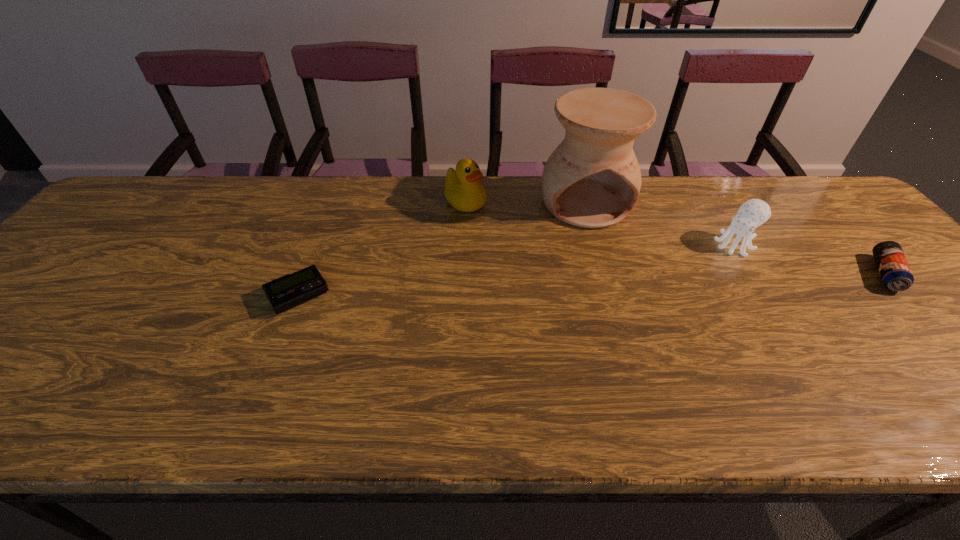
Locate an element on the screen. Image resolution: width=960 pixels, height=540 pixels. free space between the second shortest object and the octopus is located at coordinates (810, 259).

Locate an element on the screen. The width and height of the screenshot is (960, 540). free space between the fourth object from right to left and the rightmost object is located at coordinates (676, 239).

Identify the location of free area in between the second shortest object and the fourth shortest object. (676, 239).

This screenshot has width=960, height=540. What are the coordinates of `empty location between the beeper and the fourth tallest object` in the screenshot? It's located at (592, 285).

Identify the location of vacant space that's between the fourth object from left to right and the beer can. (810, 259).

Where is `vacant area that lies between the third object from right to left and the leftmost object`? Image resolution: width=960 pixels, height=540 pixels. vacant area that lies between the third object from right to left and the leftmost object is located at coordinates (443, 249).

Identify the location of free space between the second shortest object and the shortest object. This screenshot has width=960, height=540. (592, 285).

The height and width of the screenshot is (540, 960). What are the coordinates of `vacant space in between the octopus and the beeper` in the screenshot? It's located at (516, 270).

The width and height of the screenshot is (960, 540). In order to click on free space between the leftmost object and the beer can in this screenshot , I will do `click(592, 285)`.

At what (x,y) coordinates should I click in order to perform the action: click on object that is the third closest to the octopus. Please return your answer as a coordinate pair (x, y). This screenshot has width=960, height=540. Looking at the image, I should click on (462, 190).